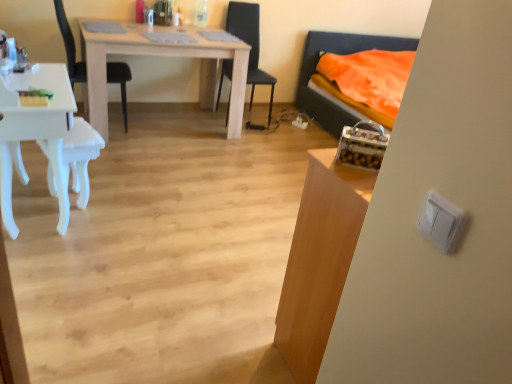
You are a GUI agent. You are given a task and a screenshot of the screen. Output one action in this format:
    pyautogui.click(x=<x>, y=<y>)
    Task: Click on the vacant space underneath white glossy desk at left (from a real-world perspective)
    
    Given the screenshot: What is the action you would take?
    pyautogui.click(x=40, y=214)